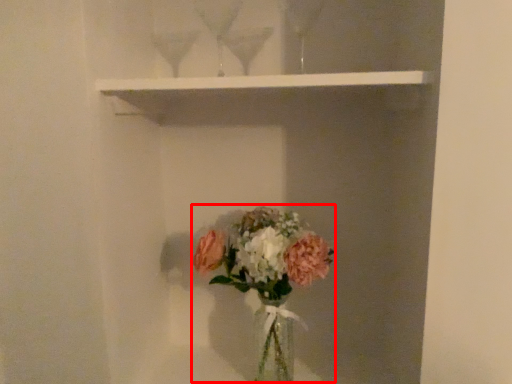
Question: From the image's perspective, where is floral arrangement (annotated by the red box) located relative to window sill?

Choices:
 (A) above
 (B) below

Answer: (B)